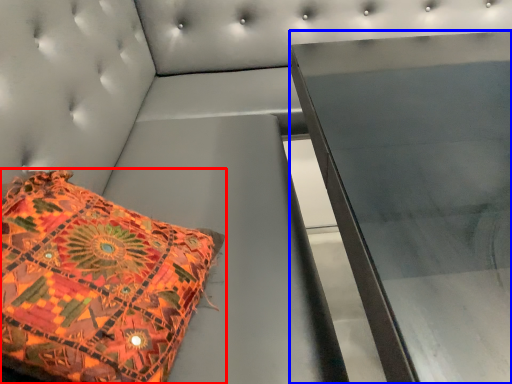
Question: Among these objects, which one is farthest to the camera, pillow (highlighted by a red box) or furniture (highlighted by a blue box)?

Choices:
 (A) pillow
 (B) furniture

Answer: (B)